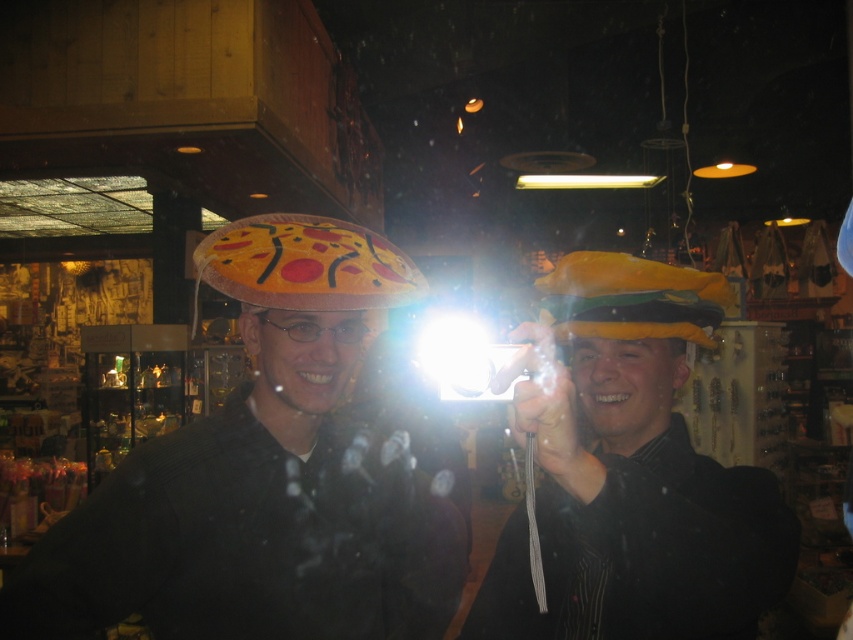
In the scene shown: Is yellow fabric hat at center below felt pizza at center?

Yes, yellow fabric hat at center is below felt pizza at center.

Can you confirm if yellow fabric hat at center is positioned above felt pizza at center?

Incorrect, yellow fabric hat at center is not positioned above felt pizza at center.

This screenshot has height=640, width=853. Describe the element at coordinates (631, 476) in the screenshot. I see `yellow fabric hat at center` at that location.

Identify the location of yellow fabric hat at center. Image resolution: width=853 pixels, height=640 pixels. (631, 476).

Who is lower down, matte pizza hat at center or yellow fabric hat at right?

Positioned lower is matte pizza hat at center.

Between point (140, 522) and point (616, 324), which one is positioned behind?

The point (140, 522) is more distant.

Describe the element at coordinates (271, 476) in the screenshot. The height and width of the screenshot is (640, 853). I see `matte pizza hat at center` at that location.

The height and width of the screenshot is (640, 853). What are the coordinates of `matte pizza hat at center` in the screenshot? It's located at (271, 476).

Find the location of a particular element. matte pizza hat at center is located at coordinates (271, 476).

Measure the distance between matte pizza hat at center and felt pizza at center.

8.39 inches

I want to click on matte pizza hat at center, so click(271, 476).

Locate an element on the screen. The height and width of the screenshot is (640, 853). matte pizza hat at center is located at coordinates (271, 476).